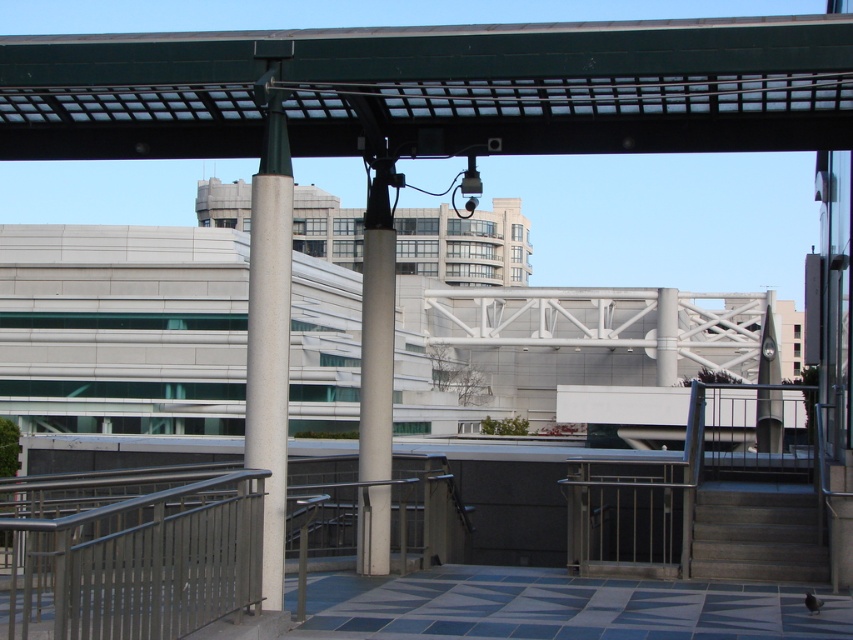
Locate an element on the screen. The width and height of the screenshot is (853, 640). white concrete pillar at left is located at coordinates (270, 328).

The height and width of the screenshot is (640, 853). What do you see at coordinates (270, 328) in the screenshot?
I see `white concrete pillar at left` at bounding box center [270, 328].

Is point (274, 368) farther from viewer compared to point (767, 570)?

No, it is in front of (767, 570).

The image size is (853, 640). Identify the location of white concrete pillar at left. (270, 328).

Is point (370, 326) positioned behind point (799, 529)?

No, it is in front of (799, 529).

Between point (370, 499) and point (807, 580), which one is positioned behind?

Point (807, 580)

Identify the location of white smooth pole at center. (376, 326).

Is white concrete pillar at left taller than white smooth pole at center?

Yes, white concrete pillar at left is taller than white smooth pole at center.

Is white concrete pillar at left positioned before white smooth pole at center?

→ Yes, white concrete pillar at left is closer to the viewer.

What do you see at coordinates (270, 328) in the screenshot? This screenshot has height=640, width=853. I see `white concrete pillar at left` at bounding box center [270, 328].

Where is `white concrete pillar at left`? This screenshot has width=853, height=640. white concrete pillar at left is located at coordinates (270, 328).